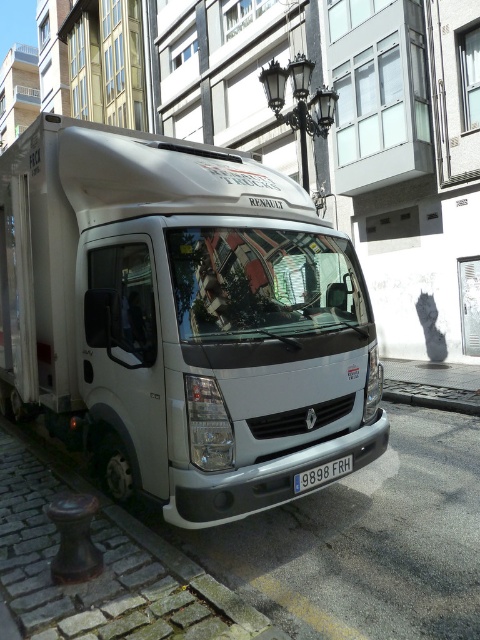
Question: Which point appears farthest from the camera in this image?

Choices:
 (A) (344, 460)
 (B) (180, 317)
 (C) (127, 625)

Answer: (A)

Question: Observing the image, what is the correct spatial positioning of white matte truck at center in reference to white plastic license plate at center?

Choices:
 (A) left
 (B) right

Answer: (A)

Question: Is white matte truck at center bigger than white plastic license plate at center?

Choices:
 (A) yes
 (B) no

Answer: (A)

Question: Does white matte truck at center appear on the left side of white plastic license plate at center?

Choices:
 (A) yes
 (B) no

Answer: (A)

Question: Which object is closer to the camera taking this photo?

Choices:
 (A) white plastic license plate at center
 (B) brown concrete curb at lower left

Answer: (B)

Question: Among these objects, which one is farthest from the camera?

Choices:
 (A) brown concrete curb at lower left
 (B) white plastic license plate at center

Answer: (B)